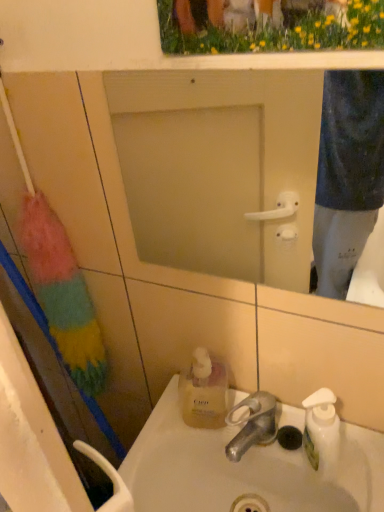
Question: Is point (170, 128) closer or farther from the camera than point (246, 444)?

Choices:
 (A) closer
 (B) farther

Answer: (B)

Question: Based on their positions, is frosted glass mirror at center located to the left or right of silver metallic faucet at sink center?

Choices:
 (A) right
 (B) left

Answer: (B)

Question: Which of these objects is positioned closest to the silver metallic faucet at sink center?

Choices:
 (A) translucent yellow liquid at sink center
 (B) yellow grass at upper center
 (C) frosted glass mirror at center
 (D) white glossy sink at center

Answer: (A)

Question: Which of these objects is positioned closest to the translucent yellow liquid at sink center?

Choices:
 (A) white glossy sink at center
 (B) frosted glass mirror at center
 (C) silver metallic faucet at sink center
 (D) yellow grass at upper center

Answer: (C)